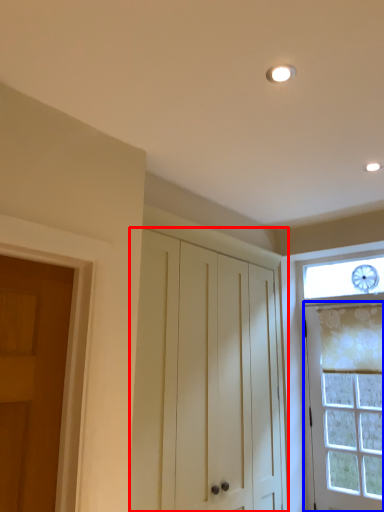
Question: Which object appears farthest to the camera in this image, cabinetry (highlighted by a red box) or door (highlighted by a blue box)?

Choices:
 (A) cabinetry
 (B) door

Answer: (B)